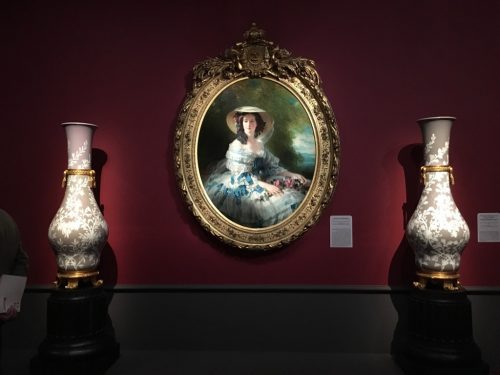
The height and width of the screenshot is (375, 500). Find the location of `frame`. frame is located at coordinates (312, 211).